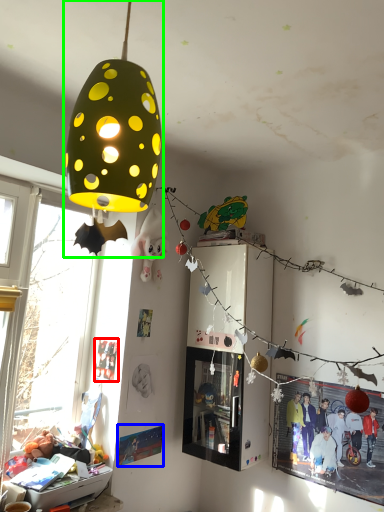
Question: Which object is the closest to the poster page (highlighted by a red box)? Choose among these: poster page (highlighted by a blue box) or lamp (highlighted by a green box).

Choices:
 (A) poster page
 (B) lamp

Answer: (A)